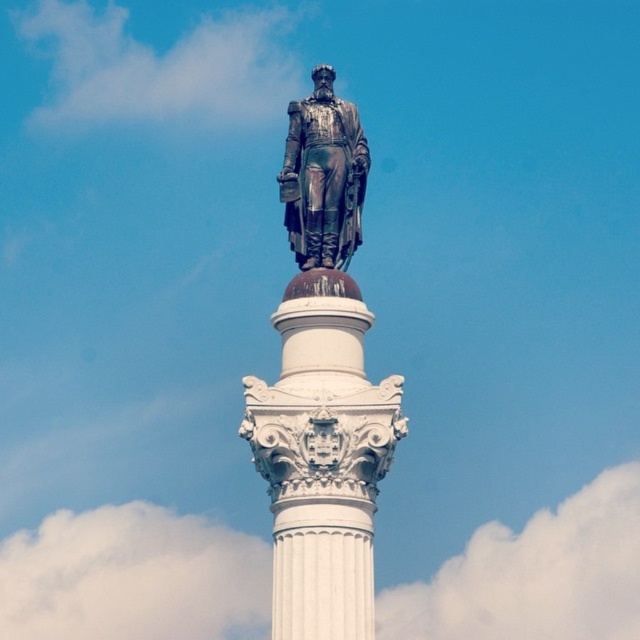
Does white marble column at center lie in front of bronze statue at center?

Yes, it is.

Is the position of white marble column at center more distant than that of bronze statue at center?

No.

I want to click on white marble column at center, so click(323, 458).